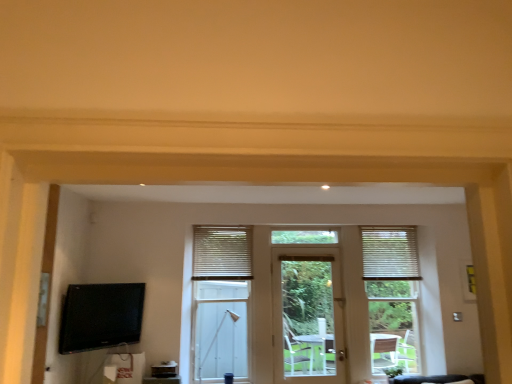
Question: From a real-world perspective, relative to white textured blinds at center, the second window blind when ordered from right to left, is white textured blinds at center vertically above or below?

Choices:
 (A) below
 (B) above

Answer: (A)

Question: In the image, is white textured blinds at center positioned in front of or behind white textured blinds at center, the second window blind when ordered from right to left?

Choices:
 (A) front
 (B) behind

Answer: (A)

Question: Which is farther from the black glossy tv at lower left?

Choices:
 (A) white textured blinds at center, the second window blind when ordered from right to left
 (B) white textured blinds at right, marked as the 1th window blind in a right-to-left arrangement
 (C) white textured blinds at center
 (D) white wood window frame at right
 (E) white wooden door at center

Answer: (B)

Question: Which of these objects is positioned closest to the white textured blinds at center, the second window blind when ordered from right to left?

Choices:
 (A) black glossy tv at lower left
 (B) white wooden door at center
 (C) white textured blinds at center
 (D) white wood window frame at right
 (E) white textured blinds at right, marked as the 1th window blind in a right-to-left arrangement

Answer: (C)